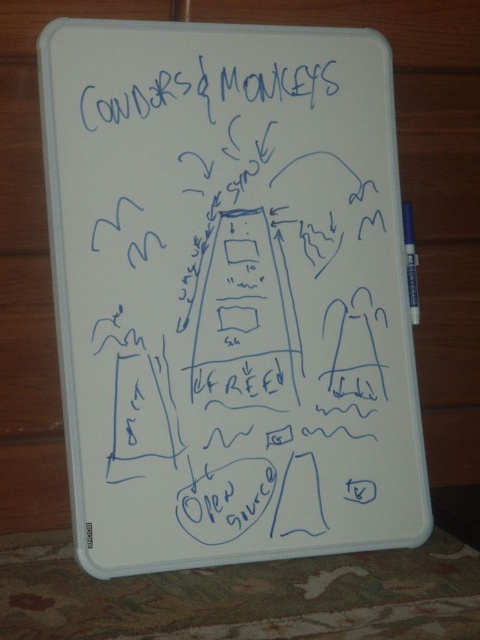
Question: In this image, where is white matte whiteboard at center located relative to white plastic pen at right?

Choices:
 (A) left
 (B) right

Answer: (A)

Question: Among these points, which one is nearest to the camera?

Choices:
 (A) (286, 84)
 (B) (91, 220)
 (C) (410, 285)

Answer: (B)

Question: Considering the relative positions of white matte whiteboard at center and blue ink writing at upper center in the image provided, where is white matte whiteboard at center located with respect to blue ink writing at upper center?

Choices:
 (A) above
 (B) below

Answer: (B)

Question: Based on their relative distances, which object is nearer to the blue ink writing at upper center?

Choices:
 (A) white plastic pen at right
 (B) white matte whiteboard at center

Answer: (B)

Question: Estimate the real-world distances between objects in this image. Which object is closer to the white plastic pen at right?

Choices:
 (A) blue ink writing at upper center
 (B) white matte whiteboard at center

Answer: (B)

Question: Can you confirm if white matte whiteboard at center is bigger than blue ink writing at upper center?

Choices:
 (A) yes
 (B) no

Answer: (A)